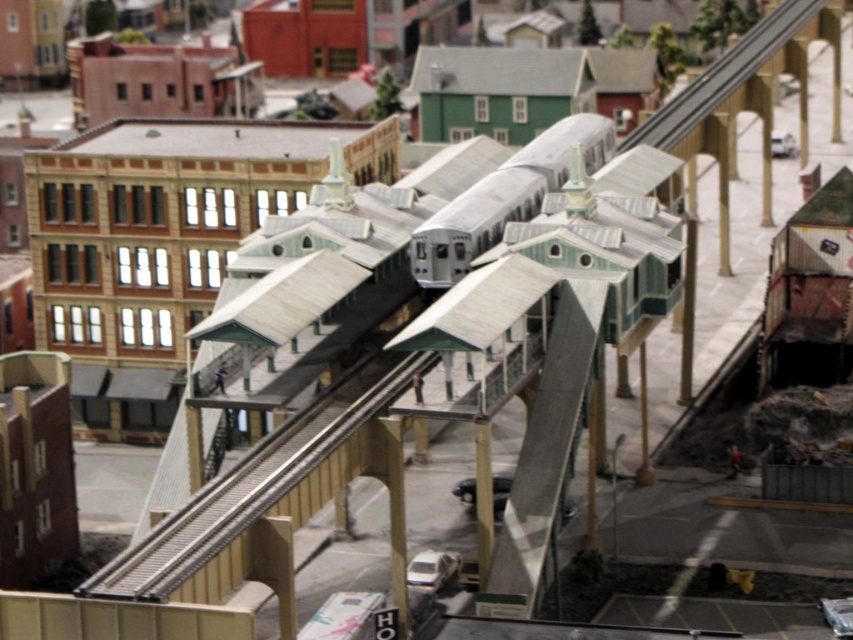
Does metallic silver train track at center appear on the left side of silver metallic train at center?

Correct, you'll find metallic silver train track at center to the left of silver metallic train at center.

Between metallic silver train track at center and silver metallic train at center, which one is positioned lower?

Positioned lower is metallic silver train track at center.

The image size is (853, 640). What do you see at coordinates (253, 483) in the screenshot?
I see `metallic silver train track at center` at bounding box center [253, 483].

Find the location of `metallic silver train track at center`. metallic silver train track at center is located at coordinates (253, 483).